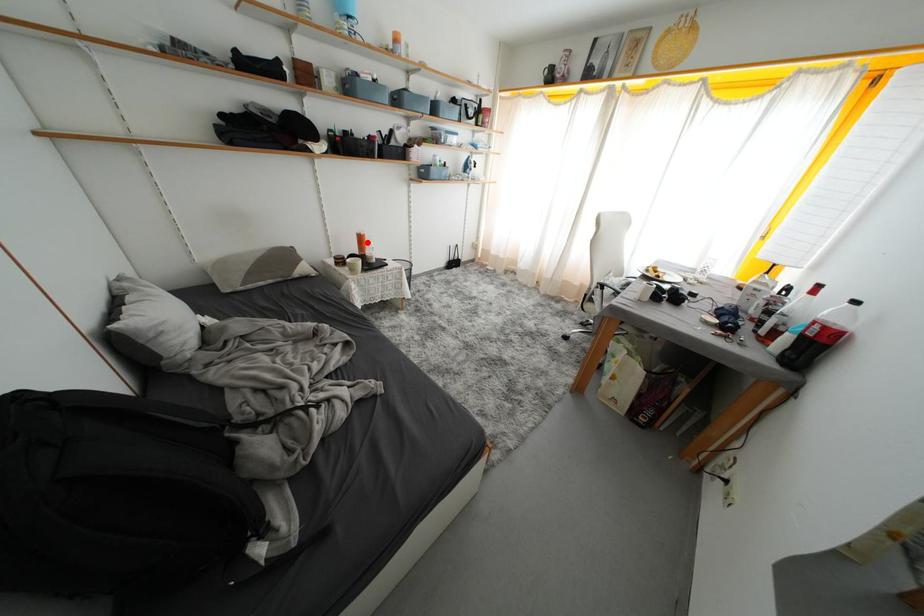
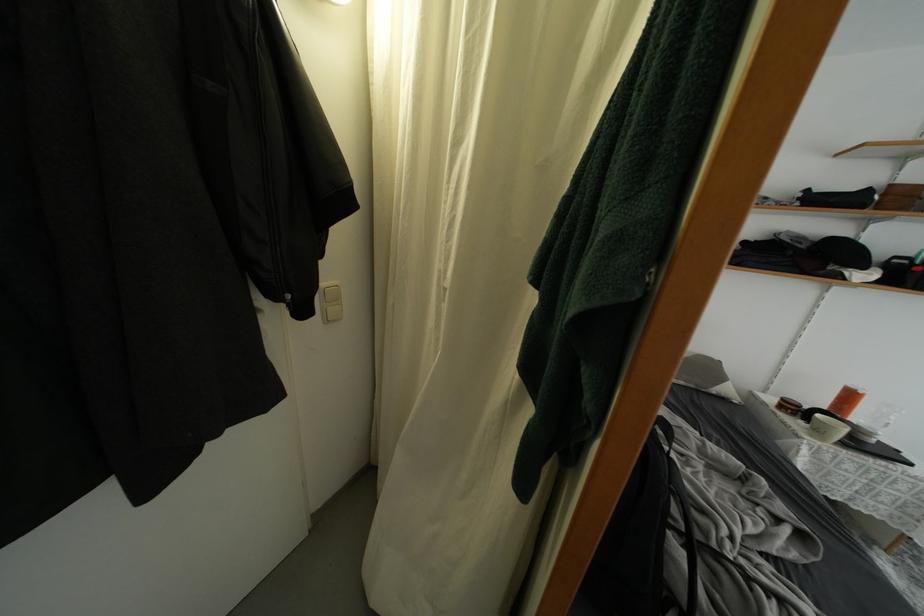
In the second image, find the point that corresponds to the highlighted location in the first image.

(856, 400)